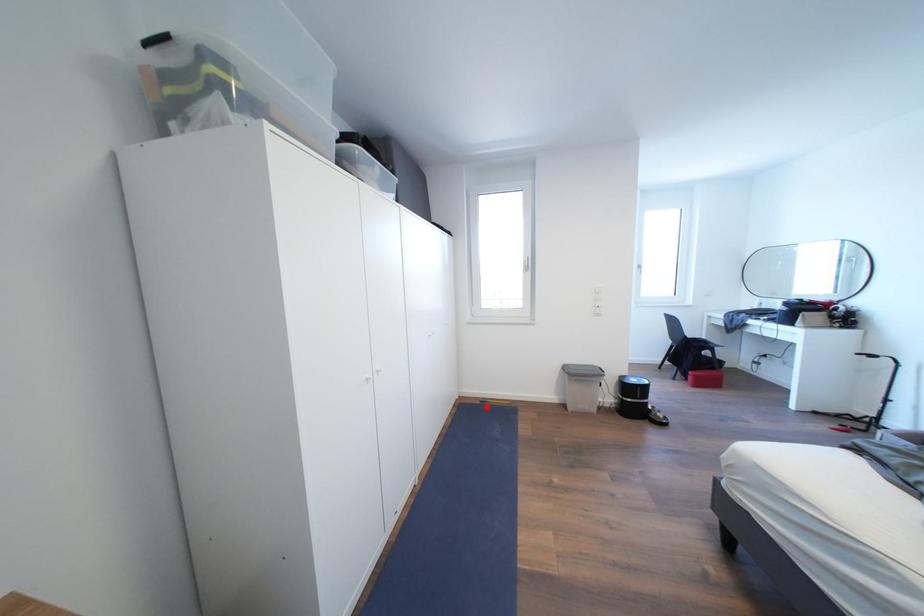
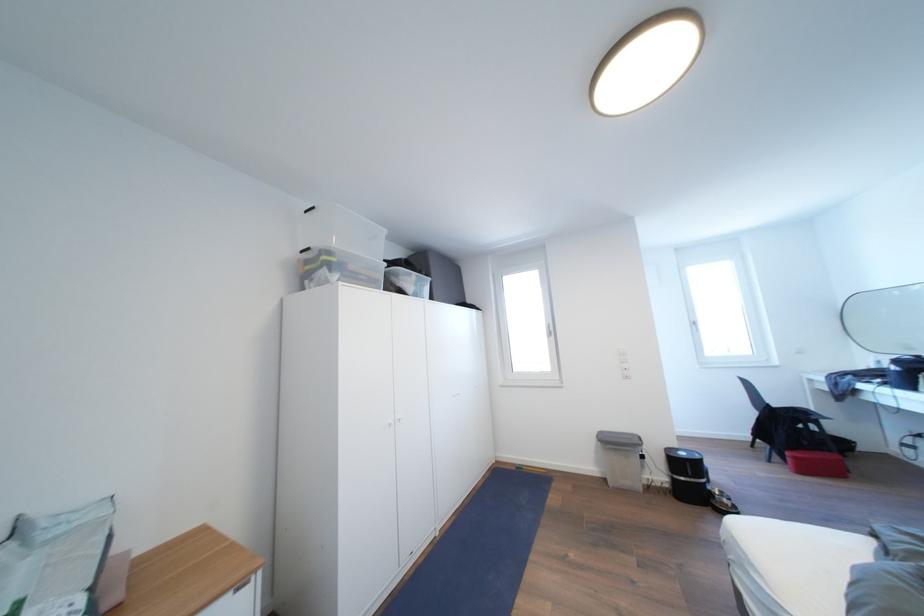
In the second image, find the point that corresponds to the highlighted location in the first image.

(521, 472)